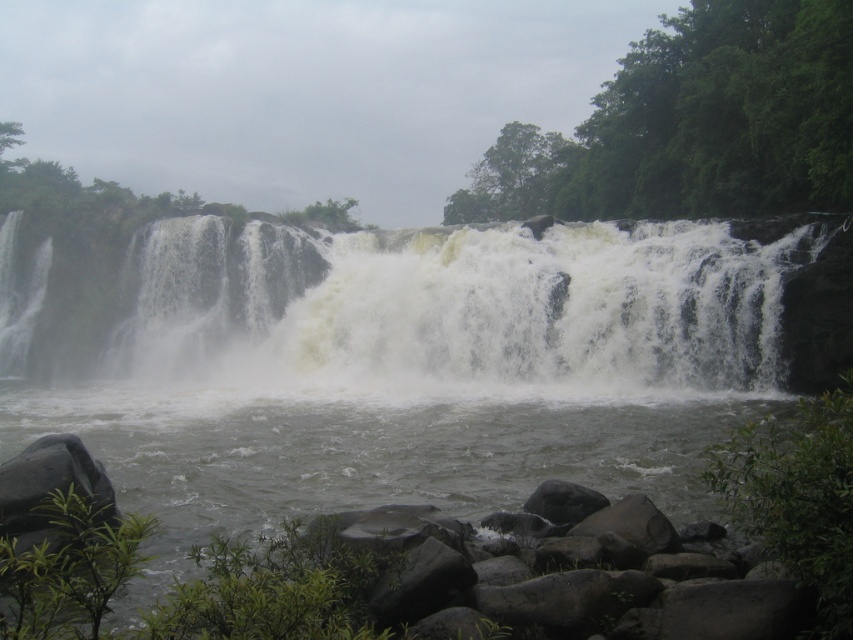
Question: Is gray rough rock at lower center behind gray rock river at center?

Choices:
 (A) no
 (B) yes

Answer: (B)

Question: Does white frothy water at center have a greater width compared to smooth gray rock at lower center?

Choices:
 (A) yes
 (B) no

Answer: (A)

Question: Is white frothy water at center bigger than smooth gray rock at lower center?

Choices:
 (A) yes
 (B) no

Answer: (A)

Question: Which object is farther from the camera taking this photo?

Choices:
 (A) smooth gray rock at lower center
 (B) white frothy water at center

Answer: (B)

Question: Which point is farther from the camera taking this photo?

Choices:
 (A) (82, 477)
 (B) (585, 508)
 (C) (392, 508)

Answer: (B)

Question: Based on their relative distances, which object is farther from the smooth gray rock at lower center?

Choices:
 (A) white frothy water at center
 (B) gray rough rock at lower center

Answer: (A)